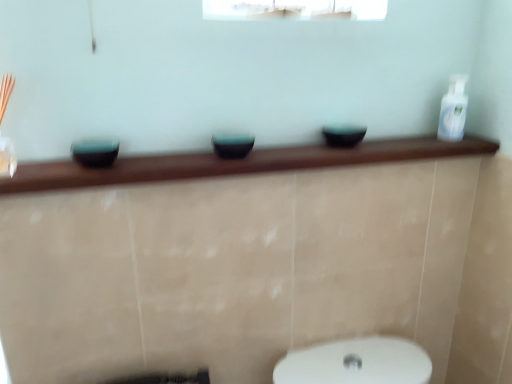
Question: Are white glossy bottle at upper right and teal glossy bowl at left, which is the 3th basin from right to left, beside each other?

Choices:
 (A) yes
 (B) no

Answer: (B)

Question: Is white glossy bottle at upper right bigger than teal glossy bowl at left, which appears as the 1th basin when viewed from the left?

Choices:
 (A) no
 (B) yes

Answer: (B)

Question: Is teal glossy bowl at left, which appears as the 1th basin when viewed from the left, a part of white glossy bottle at upper right?

Choices:
 (A) no
 (B) yes

Answer: (A)

Question: Is white glossy bottle at upper right aimed at teal glossy bowl at left, which is the 3th basin from right to left?

Choices:
 (A) no
 (B) yes

Answer: (A)

Question: Does white glossy bottle at upper right appear on the left side of teal glossy bowl at left, which appears as the 1th basin when viewed from the left?

Choices:
 (A) yes
 (B) no

Answer: (B)

Question: From the image's perspective, is matte black bowl at center, the 3th basin from the left, above or below white glossy bottle at upper right?

Choices:
 (A) above
 (B) below

Answer: (B)

Question: Looking at their shapes, would you say matte black bowl at center, the 3th basin from the left, is wider or thinner than white glossy bottle at upper right?

Choices:
 (A) wide
 (B) thin

Answer: (A)

Question: Based on their positions, is matte black bowl at center, which ranks as the 1th basin in right-to-left order, located to the left or right of white glossy bottle at upper right?

Choices:
 (A) right
 (B) left

Answer: (B)

Question: From a real-world perspective, is matte black bowl at center, the 3th basin from the left, physically located above or below white glossy bottle at upper right?

Choices:
 (A) above
 (B) below

Answer: (B)

Question: Considering the relative positions of white glossy bottle at upper right and matte black bowl at center, the 2th basin when ordered from right to left, in the image provided, is white glossy bottle at upper right to the left or to the right of matte black bowl at center, the 2th basin when ordered from right to left,?

Choices:
 (A) right
 (B) left

Answer: (A)

Question: Is point (462, 107) positioned closer to the camera than point (214, 147)?

Choices:
 (A) closer
 (B) farther

Answer: (B)

Question: Is white glossy bottle at upper right wider or thinner than matte black bowl at center, which is the 2th basin from left to right?

Choices:
 (A) thin
 (B) wide

Answer: (A)

Question: In the image, is white glossy bottle at upper right positioned in front of or behind matte black bowl at center, the 2th basin when ordered from right to left?

Choices:
 (A) behind
 (B) front

Answer: (A)

Question: Considering the positions of matte black bowl at center, the 2th basin when ordered from right to left, and matte black bowl at center, which ranks as the 1th basin in right-to-left order, in the image, is matte black bowl at center, the 2th basin when ordered from right to left, bigger or smaller than matte black bowl at center, which ranks as the 1th basin in right-to-left order,?

Choices:
 (A) big
 (B) small

Answer: (B)

Question: From a real-world perspective, is matte black bowl at center, the 2th basin when ordered from right to left, above or below matte black bowl at center, which ranks as the 1th basin in right-to-left order?

Choices:
 (A) above
 (B) below

Answer: (B)